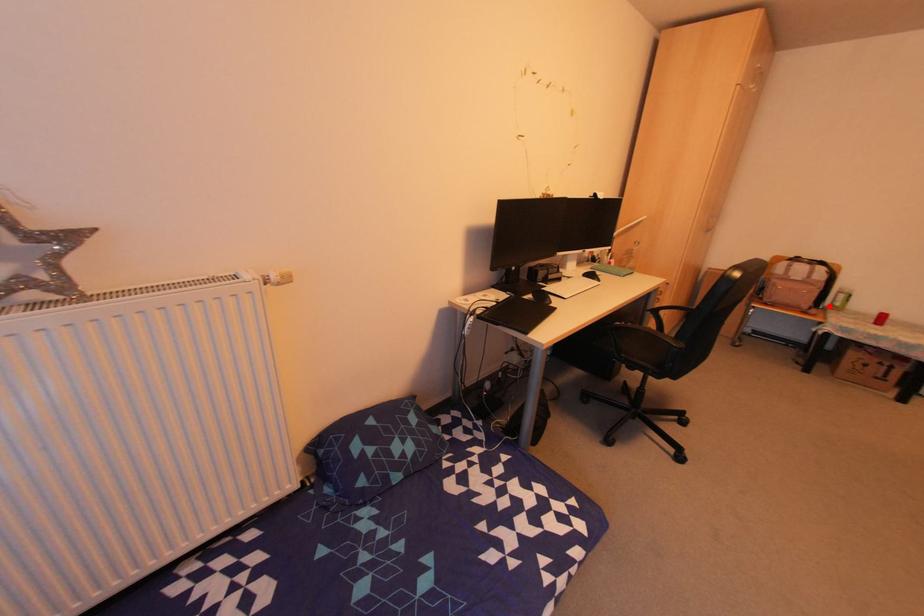
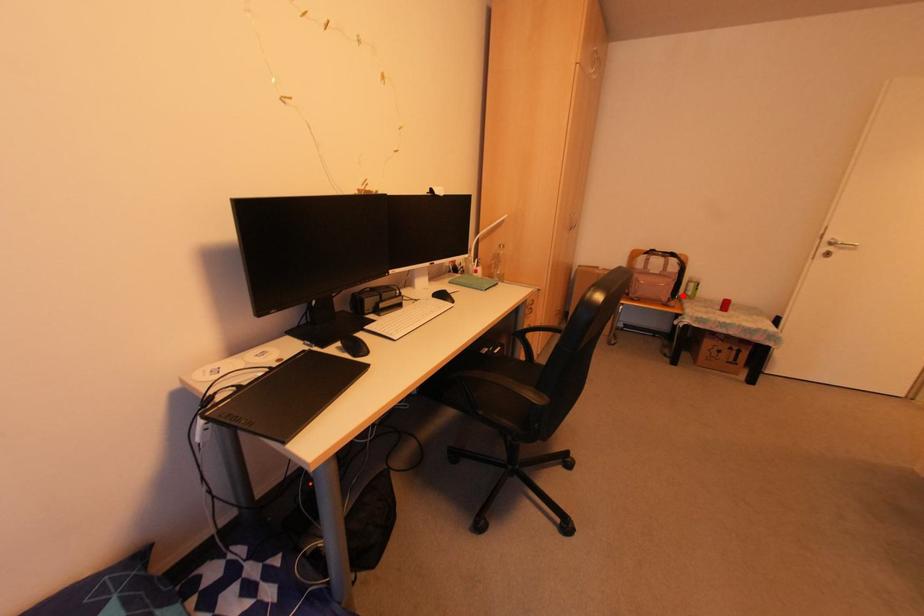
I am providing you with two images of the same scene from different viewpoints. A red point is marked on the first image and another point is marked on the second image. Do the highlighted points in image1 and image2 indicate the same real-world spot?

Yes